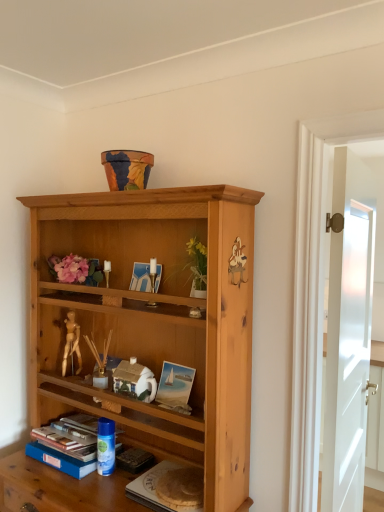
Identify the location of blue plastic can at lower center. Image resolution: width=384 pixels, height=512 pixels. (105, 446).

The width and height of the screenshot is (384, 512). Identify the location of white glossy door at right. (350, 350).

In order to face white glossy door at right, should I rotate leftwards or rightwards?

A 21.455 degree turn to the right will do.

Image resolution: width=384 pixels, height=512 pixels. Find the location of `blue plastic can at lower center`. blue plastic can at lower center is located at coordinates (105, 446).

Can you tell me how much blue plastic can at lower center and white glossy door at right differ in facing direction?

92.9 degrees.

Between blue plastic can at lower center and white glossy door at right, which one is positioned in front?

white glossy door at right is in front.

Is blue plastic can at lower center far away from white glossy door at right?

Absolutely, blue plastic can at lower center is distant from white glossy door at right.

From the image's perspective, does blue plastic can at lower center appear lower than white glossy door at right?

Correct, blue plastic can at lower center appears lower than white glossy door at right in the image.

Is point (100, 444) farther from camera compared to point (70, 448)?

That is True.

In the scene shown: Is blue plastic can at lower center taller than blue hardcover book at lower left?

Yes, blue plastic can at lower center is taller than blue hardcover book at lower left.

How much distance is there between blue hardcover book at lower left and blue plastic can at lower center?

A distance of 4.13 inches exists between blue hardcover book at lower left and blue plastic can at lower center.

Is blue hardcover book at lower left taller or shorter than blue plastic can at lower center?

blue hardcover book at lower left is shorter than blue plastic can at lower center.

Do you think blue hardcover book at lower left is within blue plastic can at lower center, or outside of it?

blue hardcover book at lower left is not enclosed by blue plastic can at lower center.

Find the location of a particular element. toy above the blue hardcover book at lower left (from a real-world perspective) is located at coordinates (105, 446).

In the scene shown: Is blue hardcover book at lower left further to camera compared to hardcover book at lower center?

Yes, it is.

Between blue hardcover book at lower left and hardcover book at lower center, which one has larger size?

With larger size is blue hardcover book at lower left.

From the picture: Considering the sizes of objects blue hardcover book at lower left and hardcover book at lower center in the image provided, who is wider, blue hardcover book at lower left or hardcover book at lower center?

blue hardcover book at lower left.

From the image's perspective, which one is positioned lower, blue hardcover book at lower left or hardcover book at lower center?

hardcover book at lower center is shown below in the image.

Is hardcover book at lower center to the left of blue plastic can at lower center from the viewer's perspective?

No, hardcover book at lower center is not to the left of blue plastic can at lower center.

Consider the image. Would you consider hardcover book at lower center to be distant from blue plastic can at lower center?

No, hardcover book at lower center is in close proximity to blue plastic can at lower center.

Could you tell me if hardcover book at lower center is turned towards blue plastic can at lower center?

No, hardcover book at lower center does not turn towards blue plastic can at lower center.

Can you confirm if hardcover book at lower center is wider than blue plastic can at lower center?

Yes.

Between blue plastic can at lower center and hardcover book at lower center, which one is positioned behind?

blue plastic can at lower center is more distant.

Does blue plastic can at lower center contain hardcover book at lower center?

No.

Does white glossy door at right come behind hardcover book at lower center?

Yes, it is behind hardcover book at lower center.

The width and height of the screenshot is (384, 512). I want to click on paperback book in front of the white glossy door at right, so click(x=155, y=489).

Considering the relative sizes of white glossy door at right and hardcover book at lower center in the image provided, is white glossy door at right thinner than hardcover book at lower center?

Yes.

Is there a large distance between white glossy door at right and hardcover book at lower center?

No.

Find the location of a particular element. This screenshot has width=384, height=512. glass door in front of the blue plastic can at lower center is located at coordinates (350, 350).

Identify the location of toy lying above the blue hardcover book at lower left (from the image's perspective). (105, 446).

From the image, which object appears to be nearer to blue hardcover book at lower left, blue plastic can at lower center or white glossy door at right?

blue plastic can at lower center lies closer to blue hardcover book at lower left than the other object.

Based on their spatial positions, is blue plastic can at lower center or hardcover book at lower center further from blue hardcover book at lower left?

hardcover book at lower center lies further to blue hardcover book at lower left than the other object.

Which object lies nearer to the anchor point white glossy door at right, blue hardcover book at lower left or hardcover book at lower center?

hardcover book at lower center is positioned closer to the anchor white glossy door at right.

Considering their positions, is blue plastic can at lower center positioned further to hardcover book at lower center than blue hardcover book at lower left?

blue hardcover book at lower left lies further to hardcover book at lower center than the other object.

Estimate the real-world distances between objects in this image. Which object is closer to blue hardcover book at lower left, white glossy door at right or hardcover book at lower center?

Based on the image, hardcover book at lower center appears to be nearer to blue hardcover book at lower left.

From the image, which object appears to be nearer to white glossy door at right, blue plastic can at lower center or hardcover book at lower center?

The object closer to white glossy door at right is hardcover book at lower center.

Estimate the real-world distances between objects in this image. Which object is closer to blue plastic can at lower center, blue hardcover book at lower left or white glossy door at right?

Based on the image, blue hardcover book at lower left appears to be nearer to blue plastic can at lower center.

Considering their positions, is blue hardcover book at lower left positioned further to hardcover book at lower center than white glossy door at right?

white glossy door at right lies further to hardcover book at lower center than the other object.

In order to click on paperback book situated between blue plastic can at lower center and white glossy door at right from left to right in this screenshot , I will do `click(155, 489)`.

The height and width of the screenshot is (512, 384). I want to click on toy between blue hardcover book at lower left and white glossy door at right in the horizontal direction, so click(105, 446).

Where is `toy between blue hardcover book at lower left and hardcover book at lower center in the horizontal direction`? This screenshot has width=384, height=512. toy between blue hardcover book at lower left and hardcover book at lower center in the horizontal direction is located at coordinates (105, 446).

This screenshot has width=384, height=512. What are the coordinates of `paperback book between blue hardcover book at lower left and white glossy door at right from left to right` in the screenshot? It's located at (155, 489).